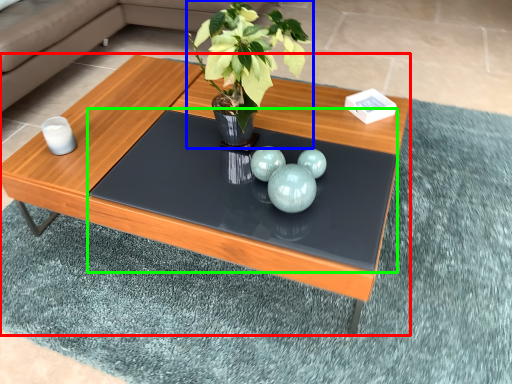
Question: Which object is the closest to the coffee table (highlighted by a red box)? Choose among these: houseplant (highlighted by a blue box) or glass table (highlighted by a green box).

Choices:
 (A) houseplant
 (B) glass table

Answer: (B)